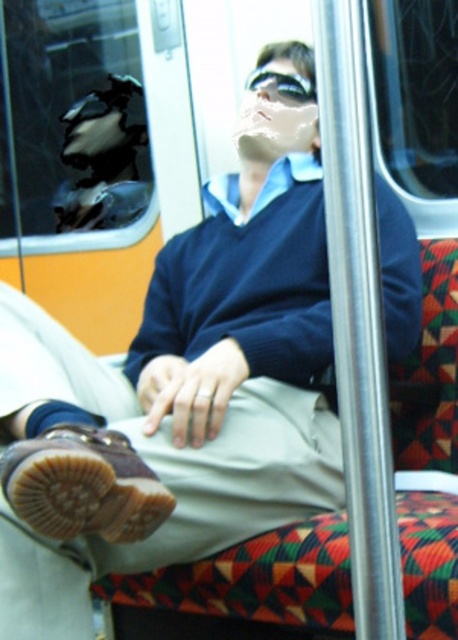
Between brown suede shoe at lower left and clear plastic goggles at upper center, which one has more height?

Standing taller between the two is brown suede shoe at lower left.

Between point (64, 424) and point (288, 81), which one is positioned in front?

Point (64, 424)

Find the location of a particular element. brown suede shoe at lower left is located at coordinates (82, 484).